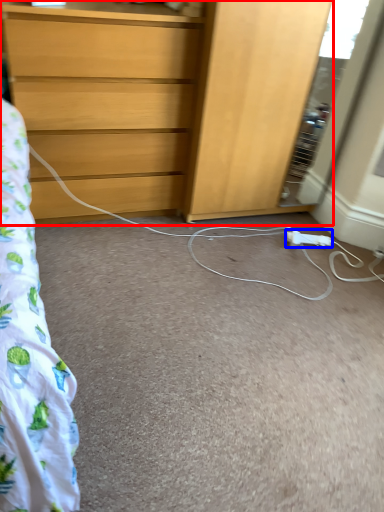
Question: Which object appears closest to the camera in this image, chest of drawers (highlighted by a red box) or extension cord (highlighted by a blue box)?

Choices:
 (A) chest of drawers
 (B) extension cord

Answer: (A)